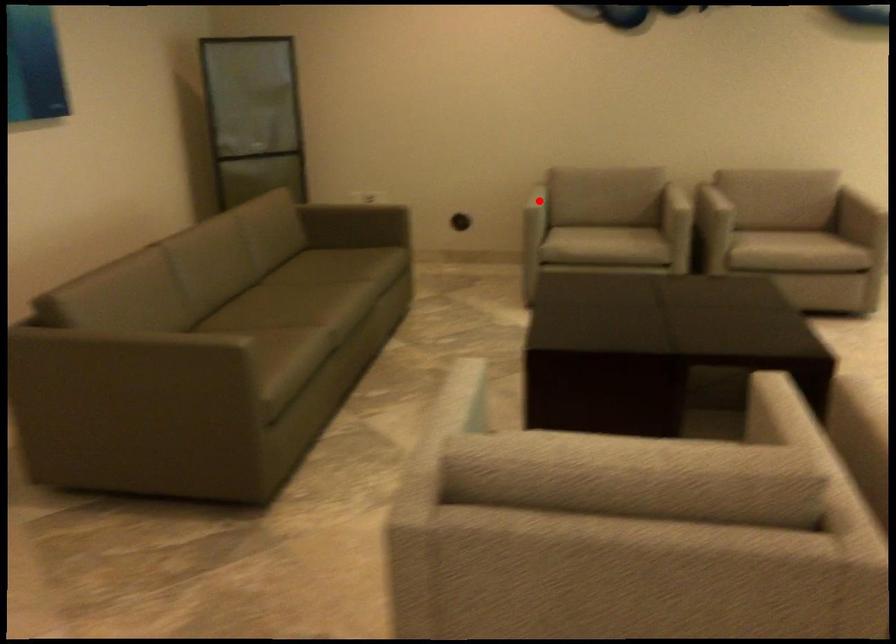
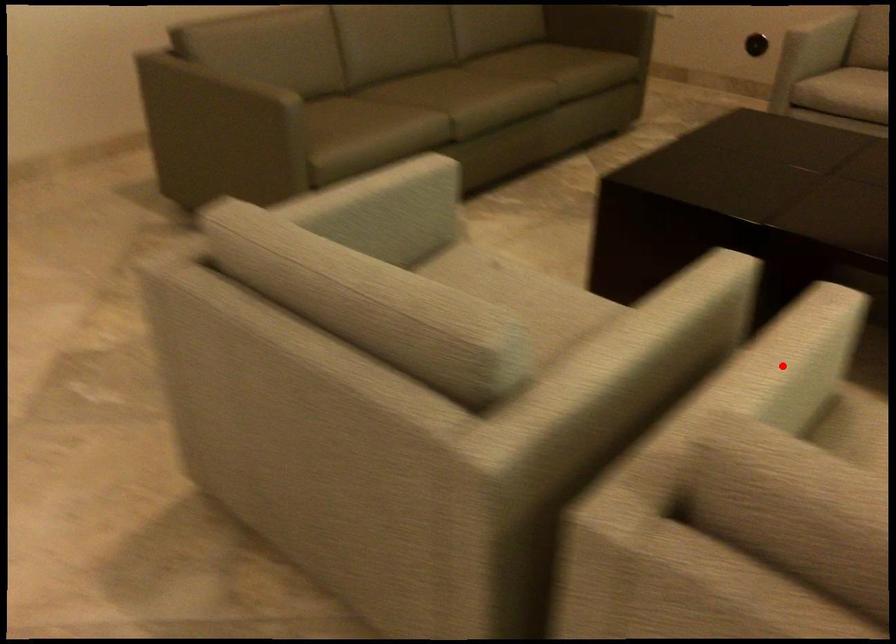
I am providing you with two images of the same scene from different viewpoints. A red point is marked on the first image and another point is marked on the second image. Is the red point in image1 aligned with the point shown in image2?

No